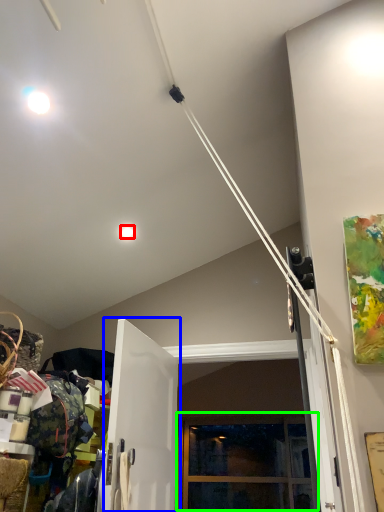
Question: Which object is positioned closest to droplight (highlighted by a red box)? Select from door (highlighted by a blue box) and window (highlighted by a green box).

Choices:
 (A) door
 (B) window

Answer: (A)